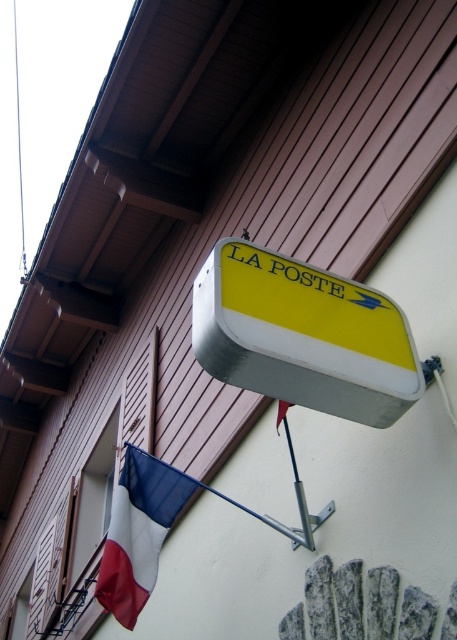
Question: Observing the image, what is the correct spatial positioning of yellow matte sign at upper center in reference to tricolor fabric flag at lower left?

Choices:
 (A) right
 (B) left

Answer: (A)

Question: Which point appears farthest from the camera in this image?

Choices:
 (A) (286, 316)
 (B) (143, 509)

Answer: (B)

Question: Does yellow matte sign at upper center have a smaller size compared to tricolor fabric flag at lower left?

Choices:
 (A) yes
 (B) no

Answer: (B)

Question: Can you confirm if yellow matte sign at upper center is positioned to the right of tricolor fabric flag at lower left?

Choices:
 (A) yes
 (B) no

Answer: (A)

Question: Among these points, which one is nearest to the camera?

Choices:
 (A) (121, 534)
 (B) (292, 276)

Answer: (B)